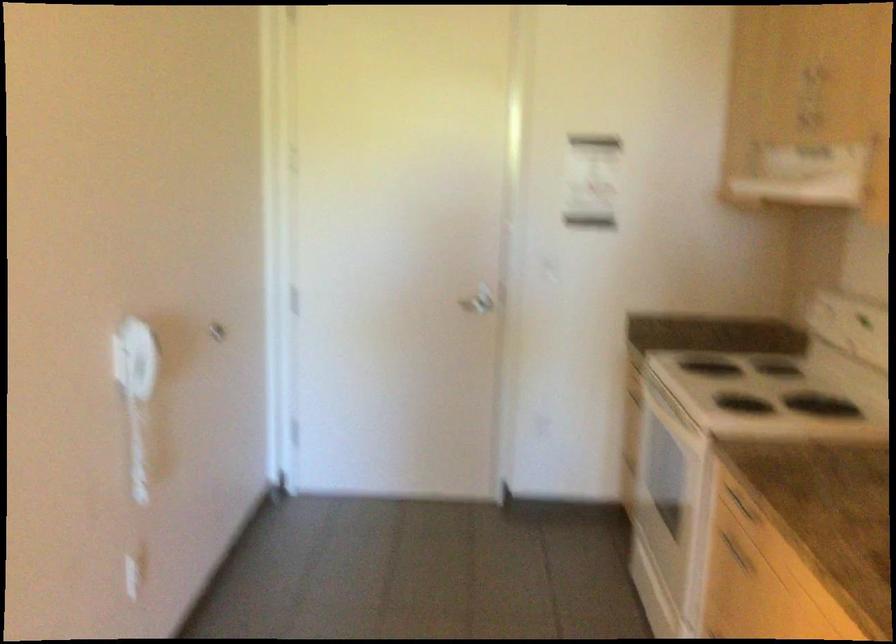
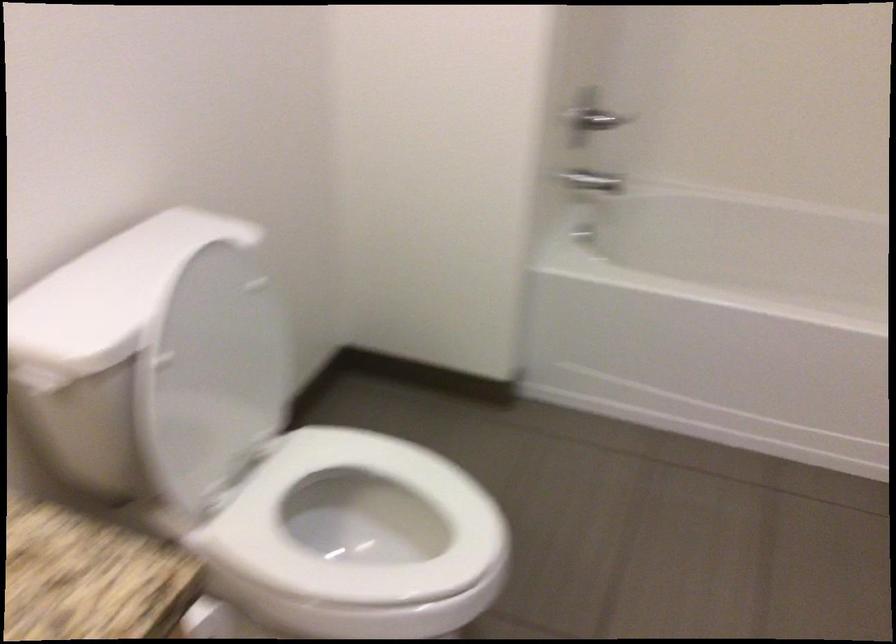
Which direction would the cameraman need to move to produce the second image?

The cameraman walked toward left, forward.